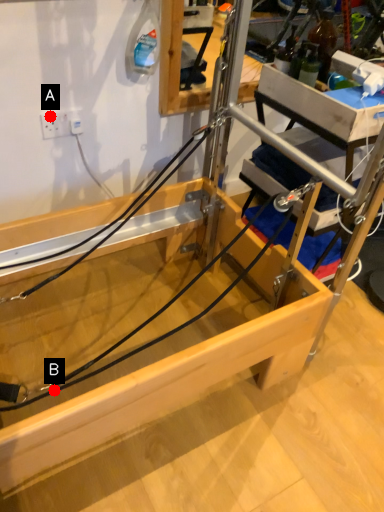
Question: Two points are circled on the image, labeled by A and B beside each circle. Which point is farther to the camera?

Choices:
 (A) A is further
 (B) B is further

Answer: (A)